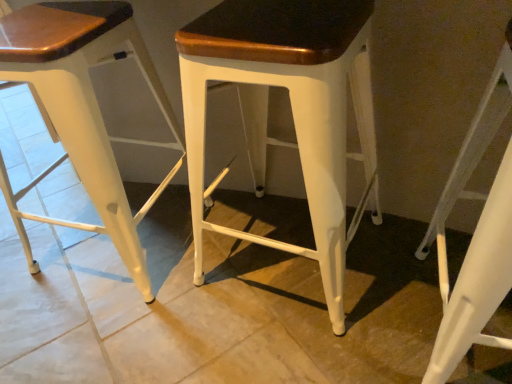
Question: Could you tell me if white metal stool at center, which is the first stool in left-to-right order, is facing white matte stool at lower right, which is the 1th stool in right-to-left order?

Choices:
 (A) no
 (B) yes

Answer: (A)

Question: Considering the relative sizes of white metal stool at center, which is the first stool in left-to-right order, and white matte stool at lower right, which is the 1th stool in right-to-left order, in the image provided, is white metal stool at center, which is the first stool in left-to-right order, thinner than white matte stool at lower right, which is the 1th stool in right-to-left order,?

Choices:
 (A) no
 (B) yes

Answer: (A)

Question: Is white metal stool at center, which is counted as the third stool, starting from the right, turned away from white matte stool at lower right, positioned as the 3th stool in left-to-right order?

Choices:
 (A) no
 (B) yes

Answer: (A)

Question: Does white metal stool at center, which is counted as the third stool, starting from the right, appear on the right side of white matte stool at lower right, positioned as the 3th stool in left-to-right order?

Choices:
 (A) yes
 (B) no

Answer: (B)

Question: Are white metal stool at center, which is the first stool in left-to-right order, and white matte stool at lower right, positioned as the 3th stool in left-to-right order, located far from each other?

Choices:
 (A) no
 (B) yes

Answer: (A)

Question: Is point (104, 0) positioned closer to the camera than point (284, 59)?

Choices:
 (A) closer
 (B) farther

Answer: (B)

Question: From a real-world perspective, is white metal stool at center, which is the first stool in left-to-right order, physically located above or below white matte stool at center, marked as the 2th stool in a left-to-right arrangement?

Choices:
 (A) above
 (B) below

Answer: (B)

Question: Would you say white metal stool at center, which is the first stool in left-to-right order, is to the left or to the right of white matte stool at center, marked as the 2th stool in a left-to-right arrangement, in the picture?

Choices:
 (A) left
 (B) right

Answer: (A)

Question: Relative to white matte stool at center, marked as the 2th stool in a left-to-right arrangement, is white metal stool at center, which is the first stool in left-to-right order, in front or behind?

Choices:
 (A) front
 (B) behind

Answer: (B)

Question: Considering their positions, is white matte stool at lower right, which is the 1th stool in right-to-left order, located in front of or behind white matte stool at center, positioned as the 2th stool in right-to-left order?

Choices:
 (A) front
 (B) behind

Answer: (A)

Question: From a real-world perspective, is white matte stool at lower right, positioned as the 3th stool in left-to-right order, positioned above or below white matte stool at center, marked as the 2th stool in a left-to-right arrangement?

Choices:
 (A) above
 (B) below

Answer: (B)

Question: Is white matte stool at lower right, which is the 1th stool in right-to-left order, inside or outside of white matte stool at center, marked as the 2th stool in a left-to-right arrangement?

Choices:
 (A) outside
 (B) inside

Answer: (A)

Question: From the image's perspective, is white matte stool at lower right, positioned as the 3th stool in left-to-right order, positioned above or below white matte stool at center, marked as the 2th stool in a left-to-right arrangement?

Choices:
 (A) below
 (B) above

Answer: (A)

Question: Is white metal stool at center, which is counted as the third stool, starting from the right, inside or outside of white matte stool at lower right, which is the 1th stool in right-to-left order?

Choices:
 (A) outside
 (B) inside

Answer: (A)

Question: Is white metal stool at center, which is counted as the third stool, starting from the right, to the left or to the right of white matte stool at lower right, positioned as the 3th stool in left-to-right order, in the image?

Choices:
 (A) left
 (B) right

Answer: (A)